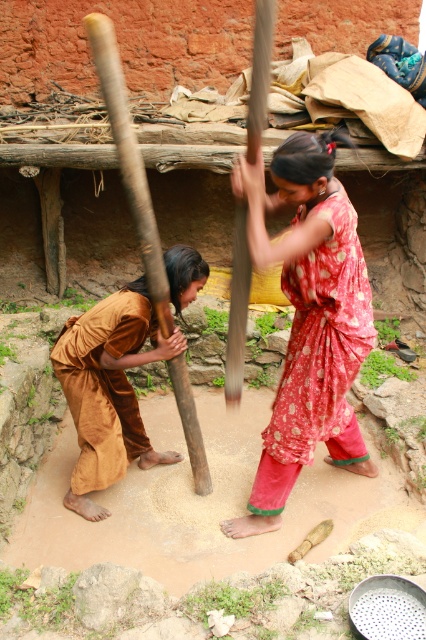
Question: Which point is closer to the camera?

Choices:
 (A) [x=313, y=180]
 (B) [x=97, y=458]

Answer: (A)

Question: Does red printed dress at center appear on the left side of brown silk robe at lower left?

Choices:
 (A) yes
 (B) no

Answer: (B)

Question: Which of the following is the closest to the observer?

Choices:
 (A) (313, 448)
 (B) (131, 296)

Answer: (A)

Question: Does red printed dress at center have a larger size compared to brown silk robe at lower left?

Choices:
 (A) yes
 (B) no

Answer: (A)

Question: Considering the relative positions of red printed dress at center and brown silk robe at lower left in the image provided, where is red printed dress at center located with respect to brown silk robe at lower left?

Choices:
 (A) left
 (B) right

Answer: (B)

Question: Which point is farther to the camera?

Choices:
 (A) (313, 152)
 (B) (88, 336)

Answer: (B)